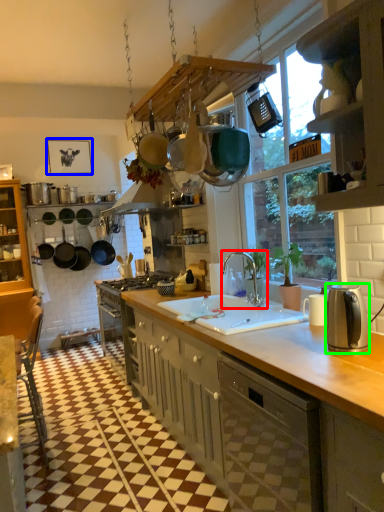
Question: Which object is positioned closest to tap (highlighted by a red box)? Select from picture frame (highlighted by a blue box) and kitchen appliance (highlighted by a green box).

Choices:
 (A) picture frame
 (B) kitchen appliance

Answer: (B)